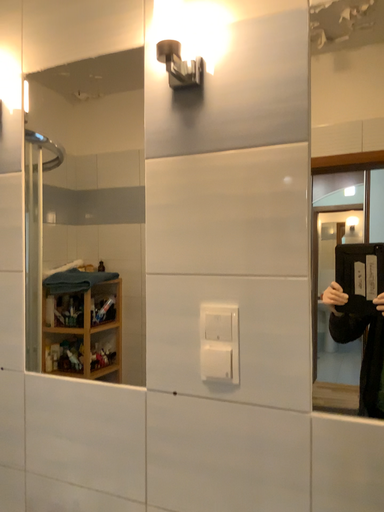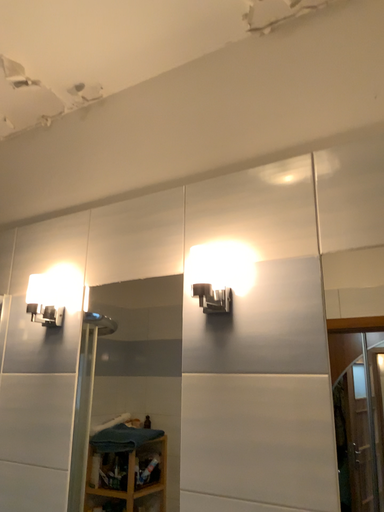
Question: How did the camera likely rotate when shooting the video?

Choices:
 (A) rotated upward
 (B) rotated downward

Answer: (A)